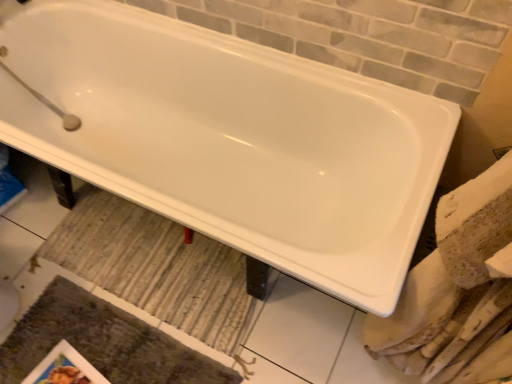
Question: Considering their positions, is striped fabric bath mat at center, the 1th bath mat when ordered from top to bottom, located in front of or behind matte paper magazine at lower left?

Choices:
 (A) behind
 (B) front

Answer: (A)

Question: Considering the relative positions of striped fabric bath mat at center, the second bath mat positioned from the bottom, and matte paper magazine at lower left in the image provided, is striped fabric bath mat at center, the second bath mat positioned from the bottom, to the left or to the right of matte paper magazine at lower left?

Choices:
 (A) right
 (B) left

Answer: (A)

Question: Which of these objects is positioned closest to the matte paper magazine at lower left?

Choices:
 (A) striped fabric bath mat at center, the second bath mat positioned from the bottom
 (B) textured gray bath mat at lower left, which is the 1th bath mat in bottom-to-top order

Answer: (B)

Question: Which object is positioned closest to the matte paper magazine at lower left?

Choices:
 (A) textured gray bath mat at lower left, placed as the 2th bath mat when sorted from top to bottom
 (B) striped fabric bath mat at center, the second bath mat positioned from the bottom

Answer: (A)